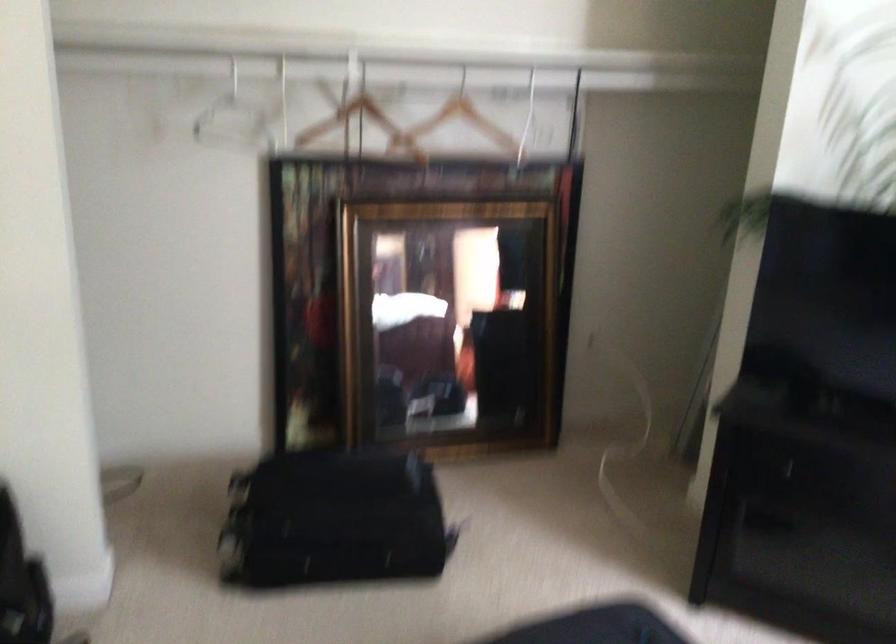
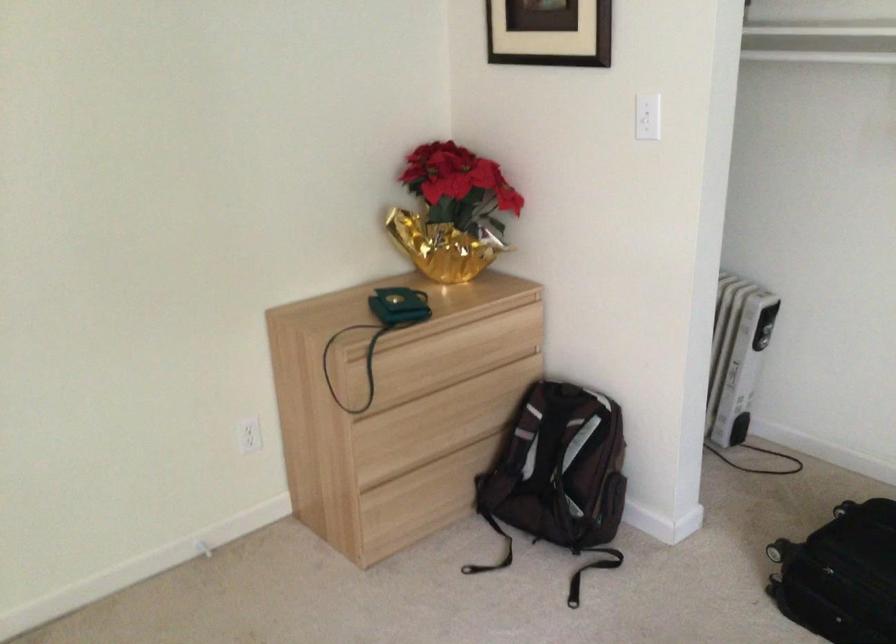
Question: I am providing you with two images of the same scene from different viewpoints. Please identify which objects are invisible in image2.

Choices:
 (A) small green purse
 (B) gold foil planter
 (C) wooden drawer front
 (D) none of these

Answer: (D)